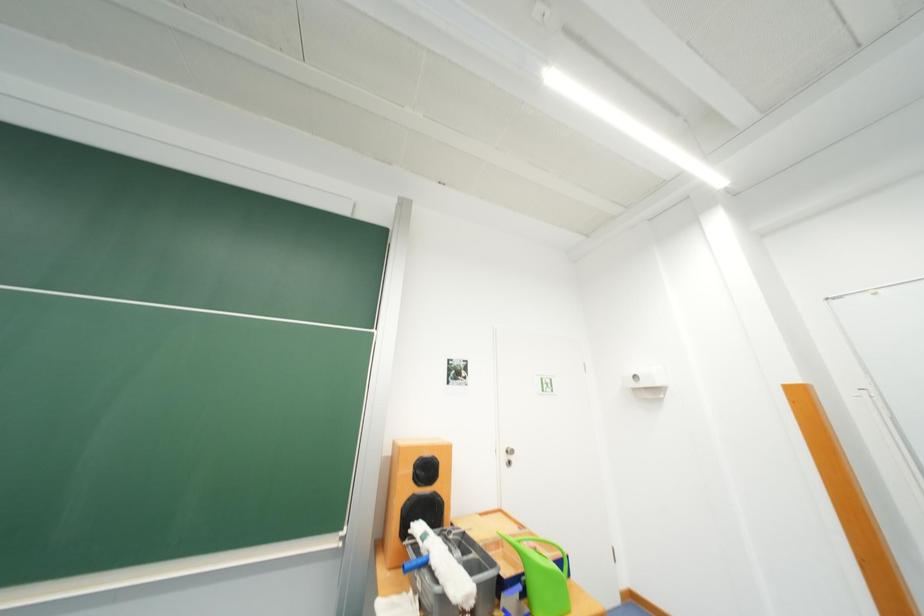
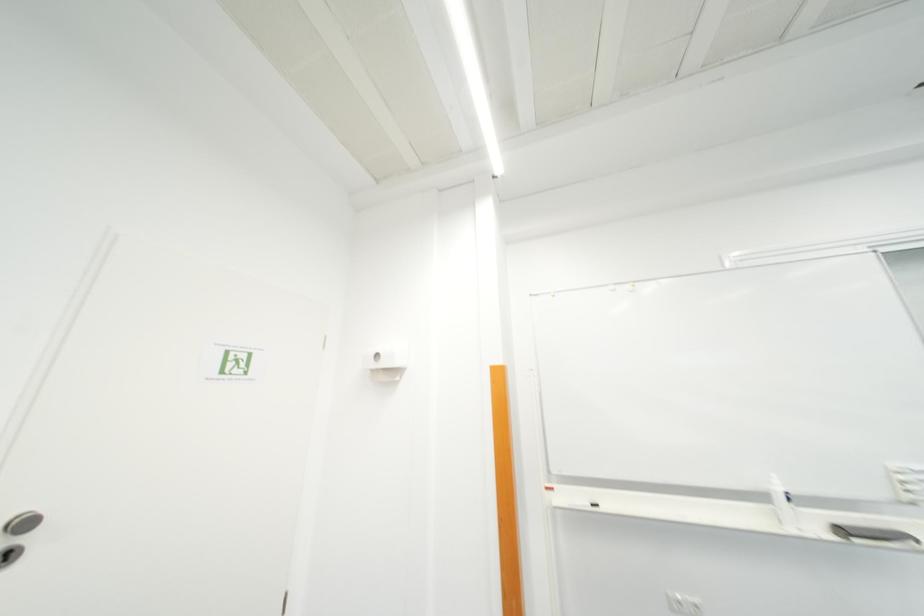
Question: The first image is from the beginning of the video and the second image is from the end. How did the camera likely rotate when shooting the video?

Choices:
 (A) Left
 (B) Right
 (C) Up
 (D) Down

Answer: (B)